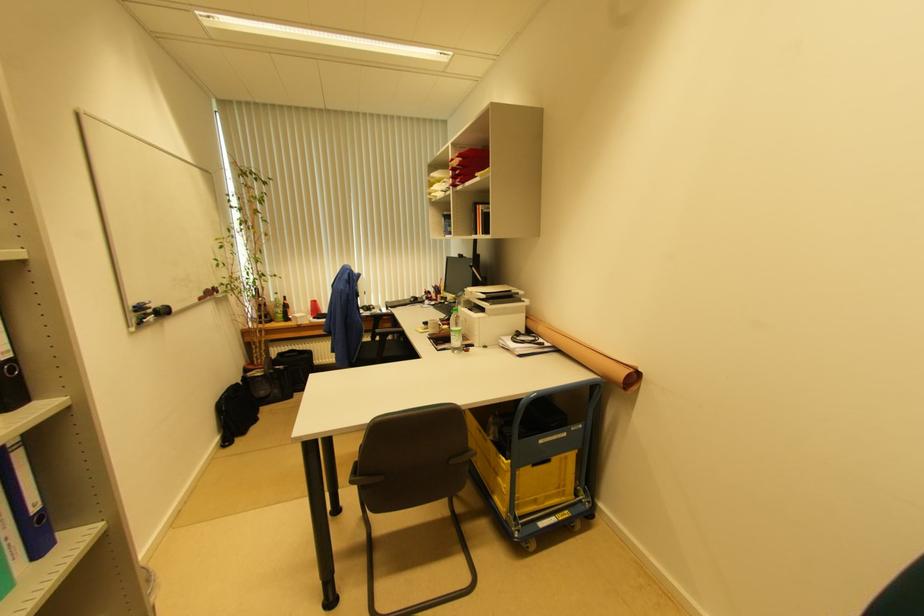
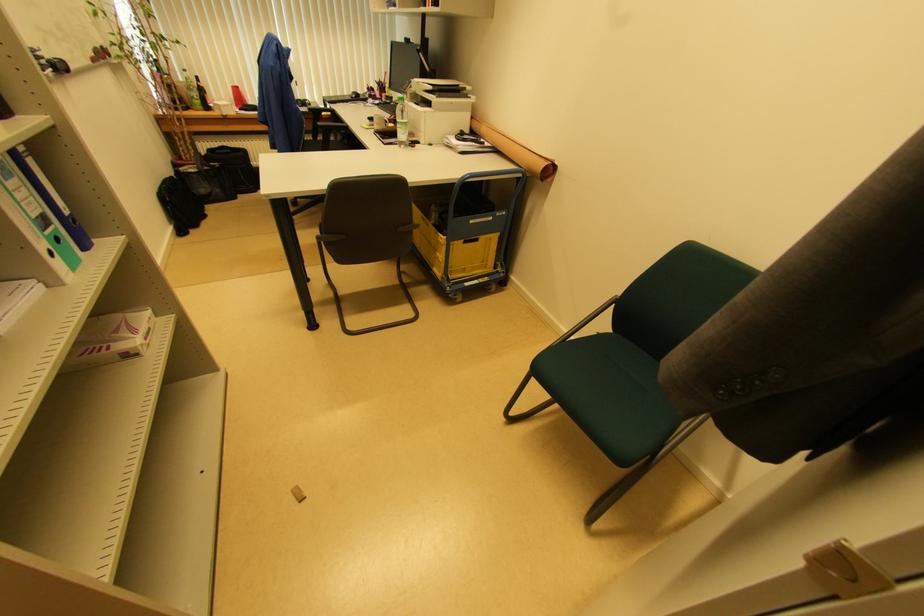
The point at (525, 318) is marked in the first image. Where is the corresponding point in the second image?

(469, 118)